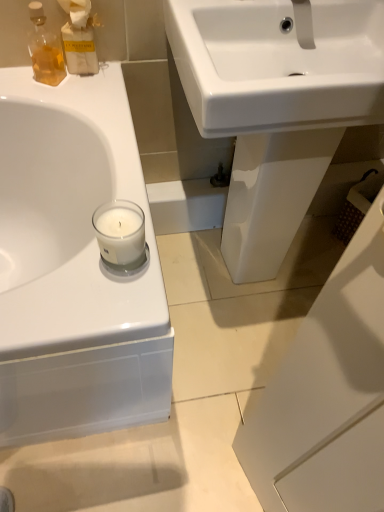
Question: Is clear glass candle at left outside of translucent amber glass bottle at upper left?

Choices:
 (A) no
 (B) yes

Answer: (B)

Question: Are clear glass candle at left and translucent amber glass bottle at upper left beside each other?

Choices:
 (A) yes
 (B) no

Answer: (B)

Question: Considering the relative positions of clear glass candle at left and translucent amber glass bottle at upper left in the image provided, is clear glass candle at left to the left of translucent amber glass bottle at upper left from the viewer's perspective?

Choices:
 (A) yes
 (B) no

Answer: (B)

Question: Considering the relative sizes of clear glass candle at left and translucent amber glass bottle at upper left in the image provided, is clear glass candle at left smaller than translucent amber glass bottle at upper left?

Choices:
 (A) yes
 (B) no

Answer: (A)

Question: Is clear glass candle at left positioned in front of translucent amber glass bottle at upper left?

Choices:
 (A) no
 (B) yes

Answer: (B)

Question: From the image's perspective, is white glossy sink at center above or below matte glass bottle at upper left?

Choices:
 (A) below
 (B) above

Answer: (A)

Question: Is white glossy sink at center to the left or to the right of matte glass bottle at upper left in the image?

Choices:
 (A) right
 (B) left

Answer: (A)

Question: From a real-world perspective, is white glossy sink at center above or below matte glass bottle at upper left?

Choices:
 (A) below
 (B) above

Answer: (A)

Question: Is point (269, 82) positioned closer to the camera than point (87, 34)?

Choices:
 (A) farther
 (B) closer

Answer: (B)

Question: From a real-world perspective, relative to clear glass candle at left, is matte glass bottle at upper left vertically above or below?

Choices:
 (A) below
 (B) above

Answer: (B)

Question: Is point [x=84, y=13] closer or farther from the camera than point [x=140, y=226]?

Choices:
 (A) farther
 (B) closer

Answer: (A)

Question: Considering their positions, is matte glass bottle at upper left located in front of or behind clear glass candle at left?

Choices:
 (A) behind
 (B) front

Answer: (A)

Question: Considering the positions of matte glass bottle at upper left and clear glass candle at left in the image, is matte glass bottle at upper left taller or shorter than clear glass candle at left?

Choices:
 (A) tall
 (B) short

Answer: (A)

Question: From the image's perspective, is translucent amber glass bottle at upper left above or below matte glass bottle at upper left?

Choices:
 (A) below
 (B) above

Answer: (A)

Question: Is point (49, 33) closer or farther from the camera than point (72, 53)?

Choices:
 (A) closer
 (B) farther

Answer: (A)